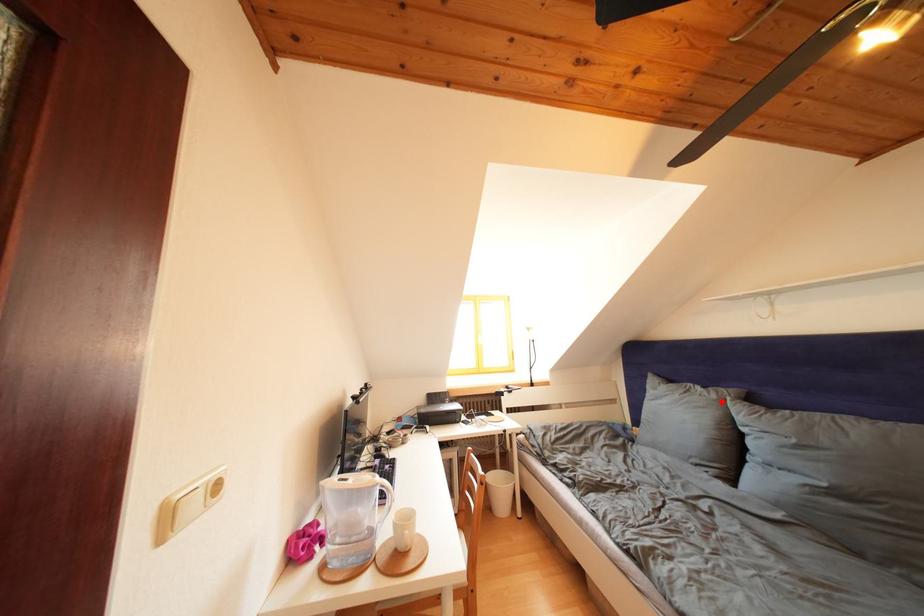
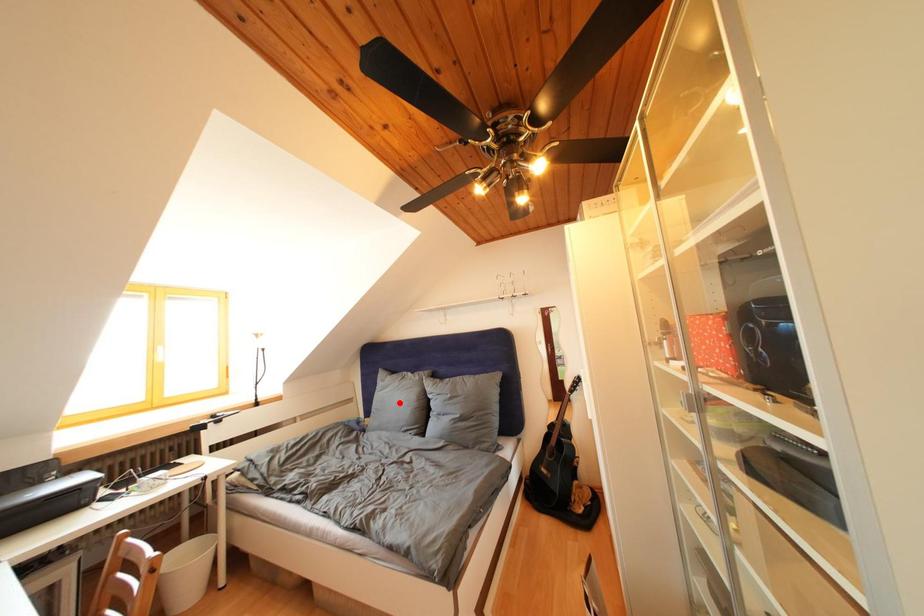
I am providing you with two images of the same scene from different viewpoints. A red point is marked on the first image and another point is marked on the second image. Are the points marked in image1 and image2 representing the same 3D position?

No